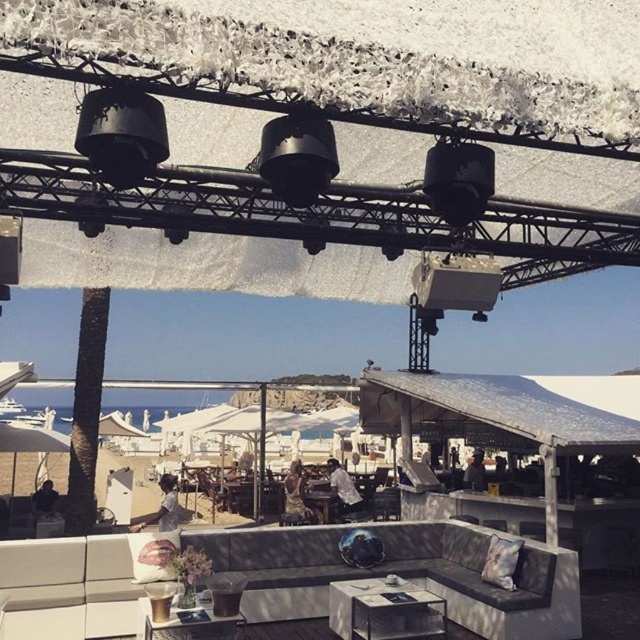
Question: Observing the image, what is the correct spatial positioning of matte white table at center in reference to wooden chair at center?

Choices:
 (A) above
 (B) below

Answer: (A)

Question: Which is farther from the matte white table at center?

Choices:
 (A) leather couch at center
 (B) wooden chair at center
 (C) wooden table at lower center

Answer: (B)

Question: Which point appears closest to the camera in this image?

Choices:
 (A) (196, 470)
 (B) (189, 632)
 (C) (340, 636)

Answer: (B)

Question: Which point is farther to the camera?

Choices:
 (A) leather couch at center
 (B) wooden chair at center

Answer: (B)

Question: Is matte white table at center smaller than wooden chair at center?

Choices:
 (A) yes
 (B) no

Answer: (A)

Question: In this image, where is leather couch at center located relative to matte white table at center?

Choices:
 (A) below
 (B) above

Answer: (B)